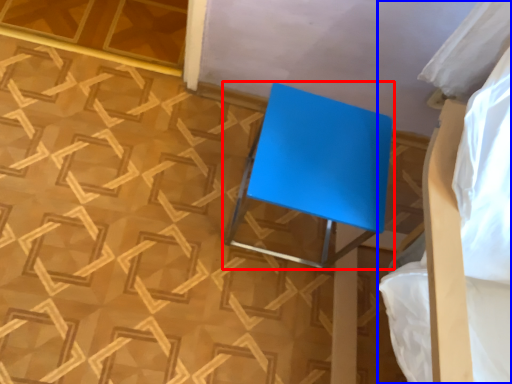
Question: Among these objects, which one is nearest to the camera, furniture (highlighted by a red box) or bed (highlighted by a blue box)?

Choices:
 (A) furniture
 (B) bed

Answer: (B)